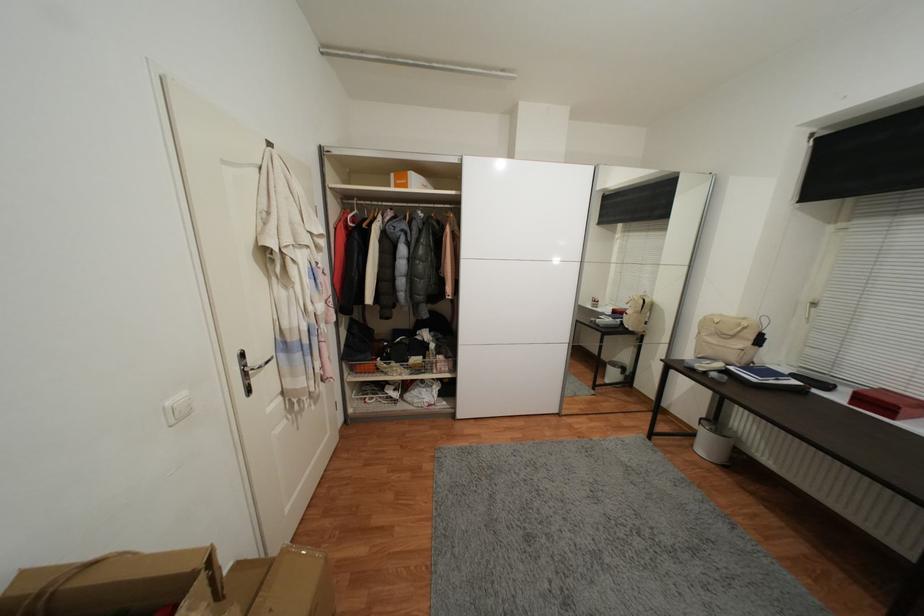
Which object does [712,442] point to?

This point indicates the white trash can.